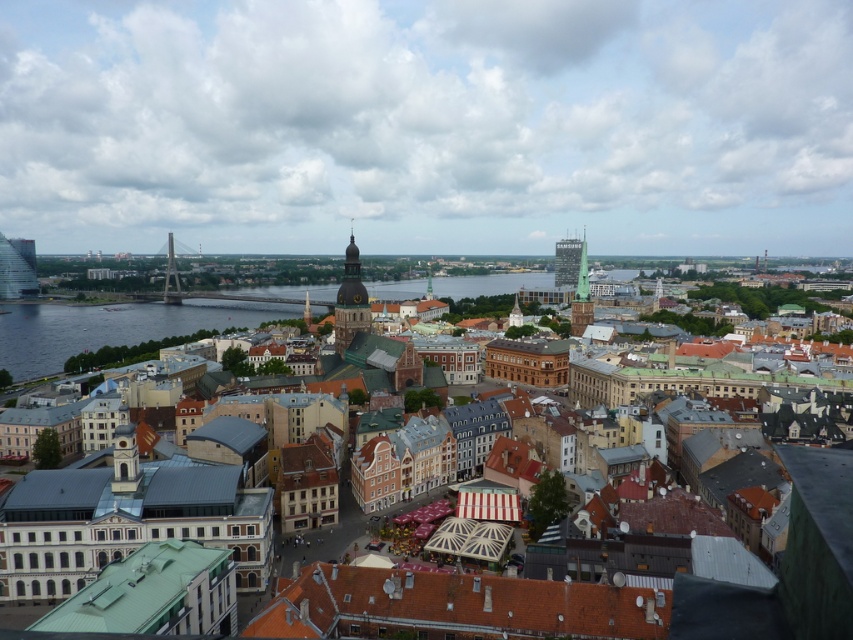
Question: Which point appears farthest from the camera in this image?

Choices:
 (A) (734, 609)
 (B) (576, 294)

Answer: (B)

Question: Does brown stone buildings at center have a smaller size compared to green copper tower at center?

Choices:
 (A) yes
 (B) no

Answer: (B)

Question: Which object is the farthest from the matte glass skyscraper at center-right?

Choices:
 (A) brown stone buildings at center
 (B) green copper tower at center

Answer: (A)

Question: Which of the following is the closest to the observer?

Choices:
 (A) matte glass skyscraper at center-right
 (B) green copper tower at center
 (C) brown stone buildings at center

Answer: (C)

Question: Is brown stone buildings at center wider than matte glass skyscraper at center-right?

Choices:
 (A) yes
 (B) no

Answer: (A)

Question: Can you confirm if brown stone buildings at center is positioned to the left of green copper tower at center?

Choices:
 (A) yes
 (B) no

Answer: (B)